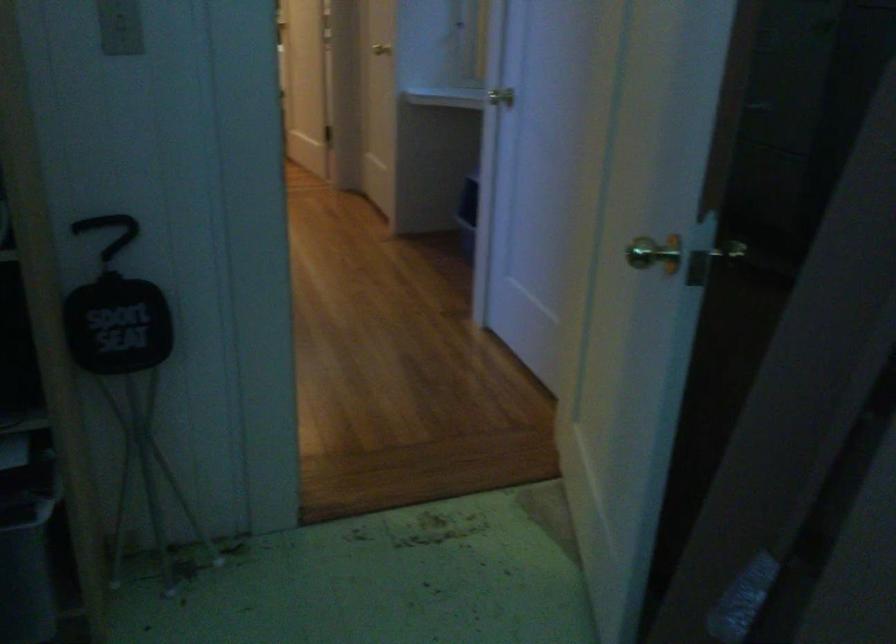
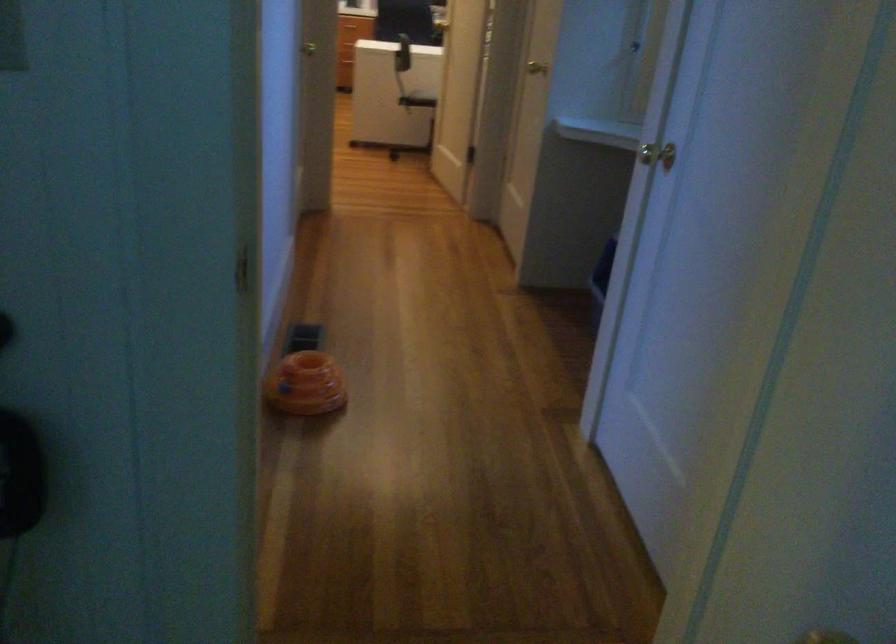
Question: The camera is either moving clockwise (left) or counter-clockwise (right) around the object. The first image is from the beginning of the video and the second image is from the end. Is the camera moving left or right when shooting the video?

Choices:
 (A) Left
 (B) Right

Answer: (B)